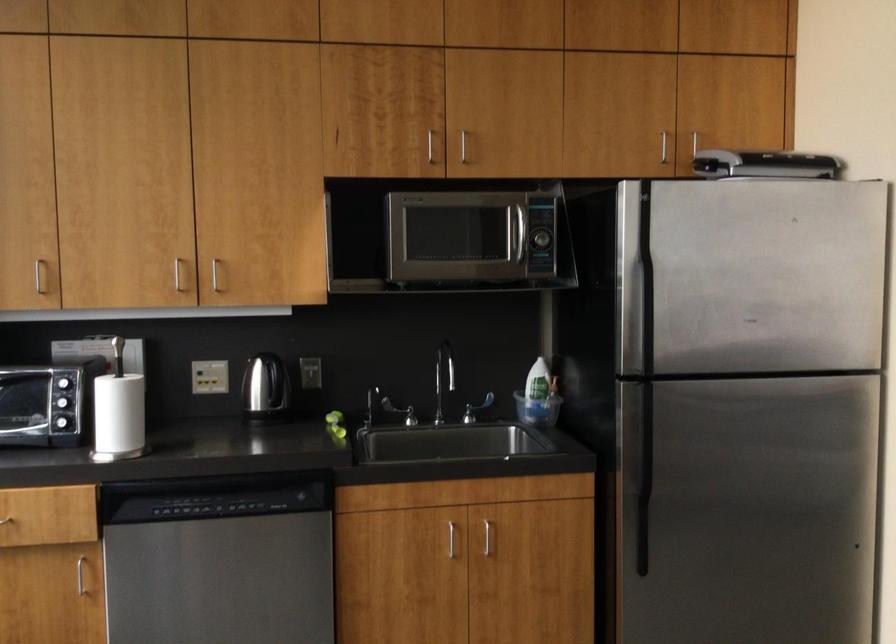
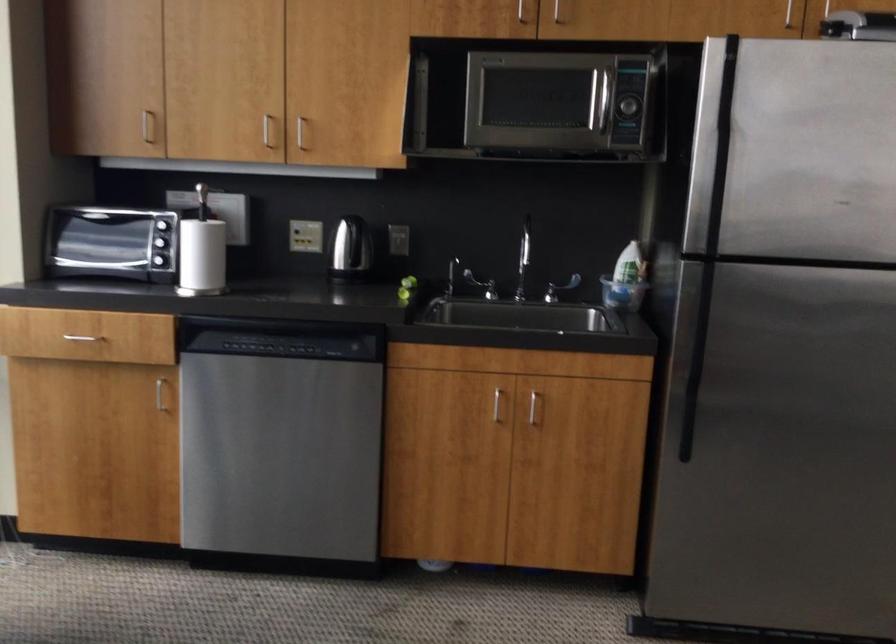
In the second image, find the point that corresponds to (x=212, y=505) in the first image.

(277, 346)